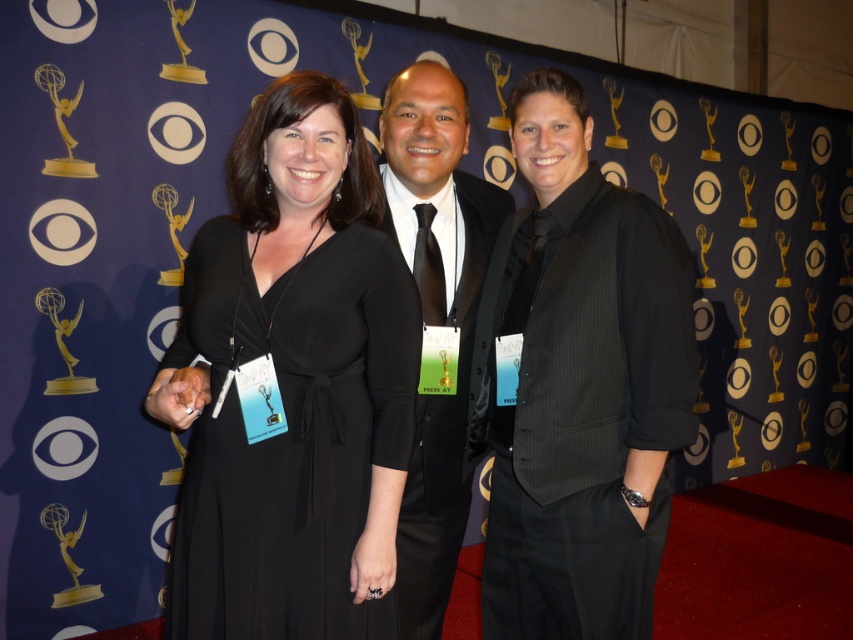
You are a photographer at the Emmy Awards. You need to take a photo of the black satin dress at center and the black pinstripe suit at center. Which one is positioned to the left of the other?

The black satin dress at center is to the left of the black pinstripe suit at center.

You are a photographer at an awards ceremony. You need to capture a closeup shot of the matte black vest at center and the black pinstripe suit at center. Given that your camera can only focus on one subject at a time, which one should you choose to ensure the details of the vest and suit are clear?

The matte black vest at center has a smaller size compared to the black pinstripe suit at center, so to ensure the details are clear, you should focus on the matte black vest at center first since smaller objects require closer focus for clarity.